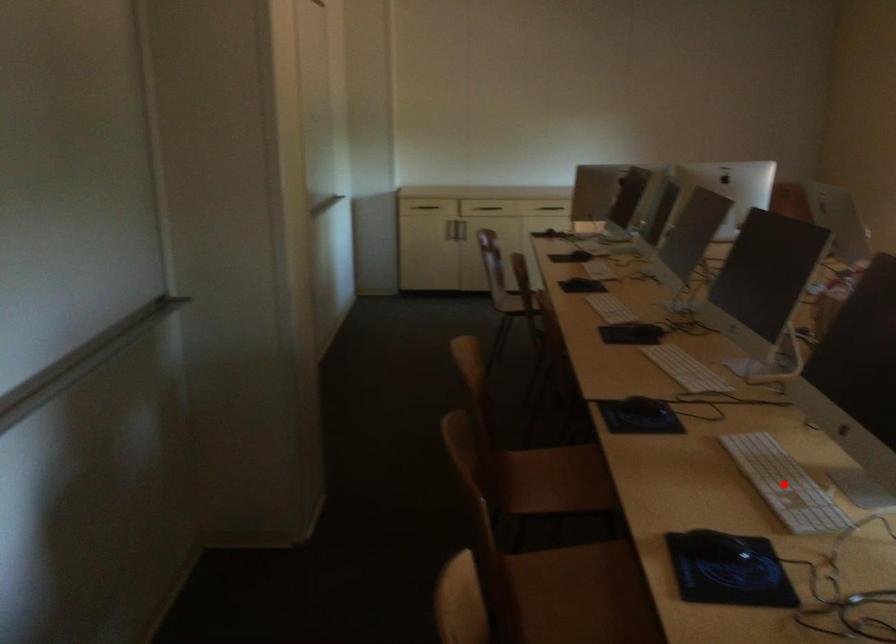
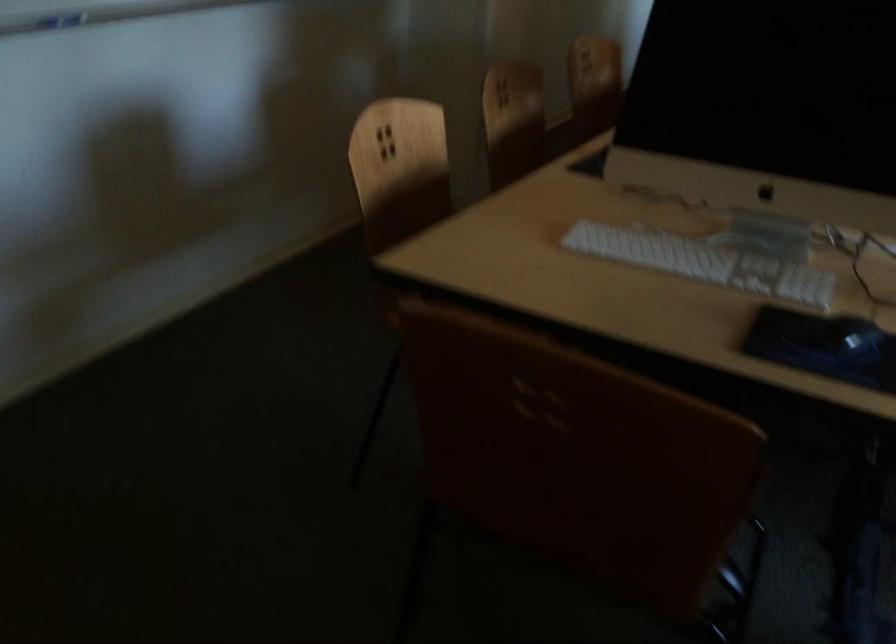
Question: I am providing you with two images of the same scene from different viewpoints. A red point is marked on the first image. Can you still see the location of the red point in image 2?

Choices:
 (A) Yes
 (B) No

Answer: (B)